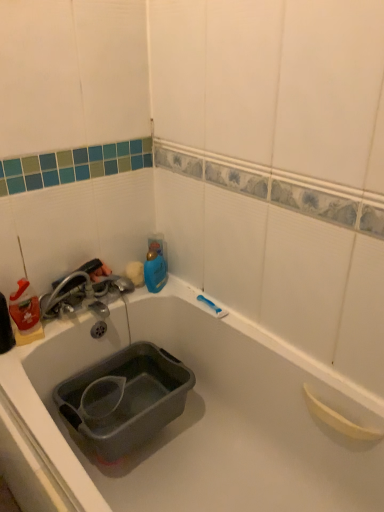
Question: Is metallic silver faucet at left to the left or to the right of translucent plastic bottle at left in the image?

Choices:
 (A) left
 (B) right

Answer: (B)

Question: Does point (94, 297) appear closer or farther from the camera than point (18, 311)?

Choices:
 (A) closer
 (B) farther

Answer: (B)

Question: Which object is the closest to the blue plastic bottle at upper center?

Choices:
 (A) translucent plastic bottle at left
 (B) metallic silver faucet at left

Answer: (B)

Question: Estimate the real-world distances between objects in this image. Which object is farther from the blue plastic bottle at upper center?

Choices:
 (A) translucent plastic bottle at left
 (B) metallic silver faucet at left

Answer: (A)